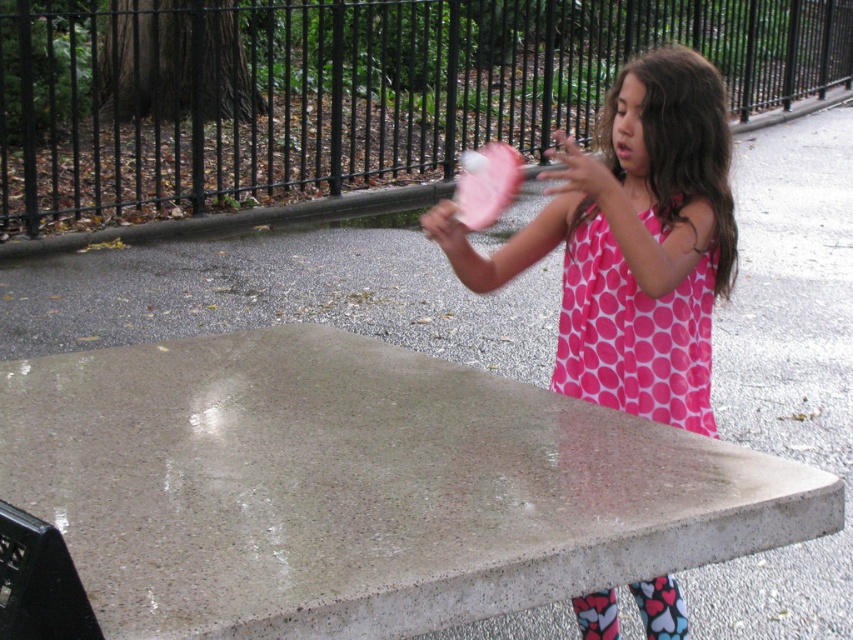
You are a photographer setting up a shot of the scene. You want to position yourself so that the concrete picnic table at center and the pink dotted dress at center are both in frame. Based on their positions, which object should you place on the left side of your photo?

The concrete picnic table at center is to the left of the pink dotted dress at center, so you should place the concrete picnic table at center on the left side of your photo.

You are a photographer trying to capture the pink dotted fabric dress at upper right in your shot. To ensure the dress is in focus, should you adjust your camera to focus on the concrete picnic table at center or behind it?

The concrete picnic table at center is in front of the pink dotted fabric dress at upper right, so to focus on the dress, the camera should be adjusted to focus behind the picnic table.